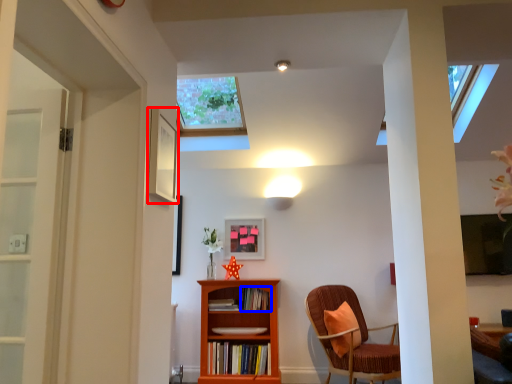
Question: Which object is further to the camera taking this photo, picture frame (highlighted by a red box) or book (highlighted by a blue box)?

Choices:
 (A) picture frame
 (B) book

Answer: (B)